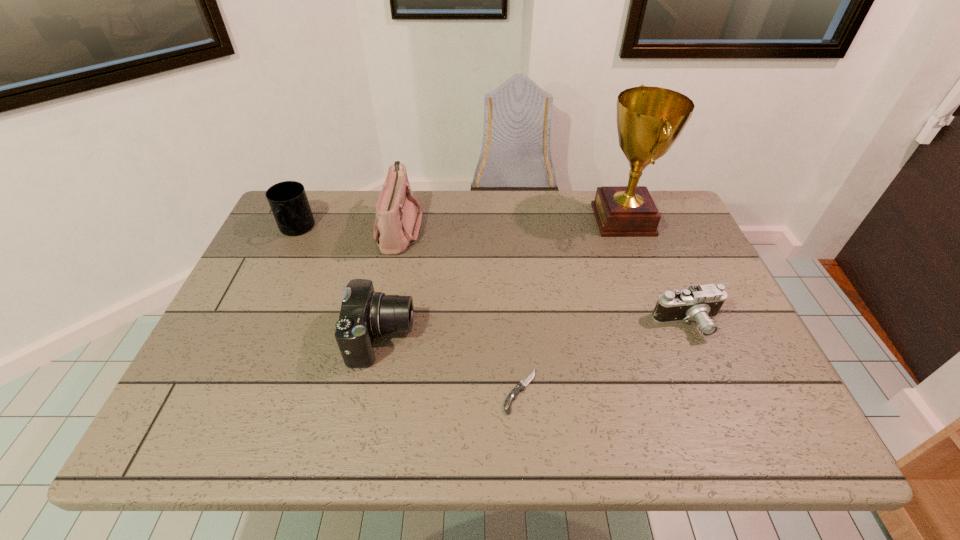
Find the location of a particular element. Image resolution: width=960 pixels, height=540 pixels. award is located at coordinates (649, 119).

The width and height of the screenshot is (960, 540). What are the coordinates of `shoulder bag` in the screenshot? It's located at click(396, 227).

Find the location of a particular element. The height and width of the screenshot is (540, 960). mug is located at coordinates (288, 201).

Where is `the taller camera`? the taller camera is located at coordinates (364, 314).

The height and width of the screenshot is (540, 960). In order to click on the fifth tallest object in this screenshot , I will do `click(699, 303)`.

Where is `the shorter camera`? This screenshot has height=540, width=960. the shorter camera is located at coordinates (699, 303).

This screenshot has width=960, height=540. I want to click on pocketknife, so click(x=511, y=397).

At what (x,y) coordinates should I click in order to perform the action: click on the fourth object from left to right. Please return your answer as a coordinate pair (x, y). The height and width of the screenshot is (540, 960). Looking at the image, I should click on (511, 397).

This screenshot has height=540, width=960. What are the coordinates of `vacant space located on the plaque of the tallest object` in the screenshot? It's located at (501, 219).

Find the location of a particular element. free space located 0.190m on the plaque of the tallest object is located at coordinates (531, 219).